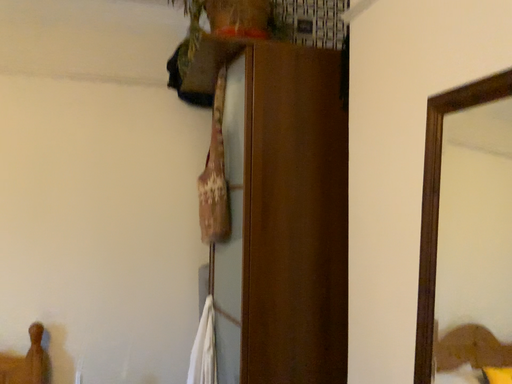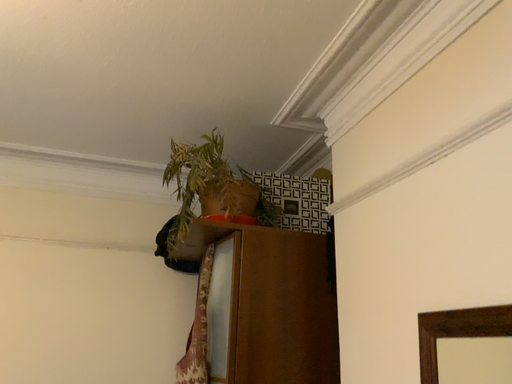
Question: How did the camera likely rotate when shooting the video?

Choices:
 (A) rotated upward
 (B) rotated downward

Answer: (A)